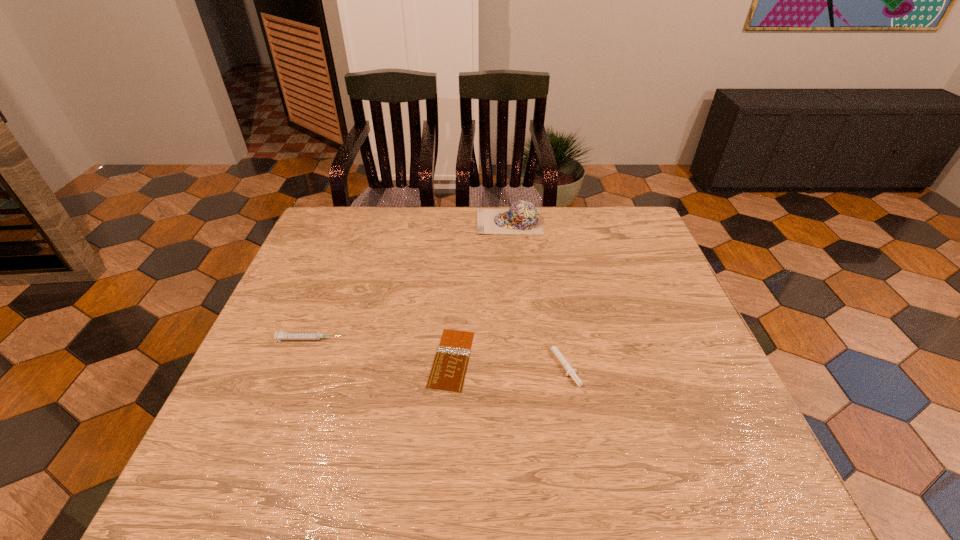
This screenshot has height=540, width=960. I want to click on empty space that is in between the third object from right to left and the shorter syringe, so click(507, 361).

I want to click on free space between the shortest object and the shorter syringe, so click(x=507, y=361).

Select which object is the second closest to the chocolate bar. Please provide its 2D coordinates. Your answer should be formatted as a tuple, i.e. [(x, y)], where the tuple contains the x and y coordinates of a point satisfying the conditions above.

[(281, 335)]

Point out which object is positioned as the third nearest to the second shortest object. Please provide its 2D coordinates. Your answer should be formatted as a tuple, i.e. [(x, y)], where the tuple contains the x and y coordinates of a point satisfying the conditions above.

[(281, 335)]

Identify the location of blank space that satisfies the following two spatial constraints: 1. at the needle end of the left syringe; 2. on the back side of the chocolate bar. (302, 359).

Find the location of `vacant area that satisfies the following two spatial constraints: 1. at the needle end of the taller syringe; 2. on the back side of the shortest object`. vacant area that satisfies the following two spatial constraints: 1. at the needle end of the taller syringe; 2. on the back side of the shortest object is located at coordinates (302, 359).

I want to click on vacant position in the image that satisfies the following two spatial constraints: 1. at the needle end of the chocolate bar; 2. on the left side of the left syringe, so click(x=302, y=359).

Find the location of `free space that satisfies the following two spatial constraints: 1. at the needle end of the left syringe; 2. on the left side of the shorter syringe`. free space that satisfies the following two spatial constraints: 1. at the needle end of the left syringe; 2. on the left side of the shorter syringe is located at coordinates (301, 362).